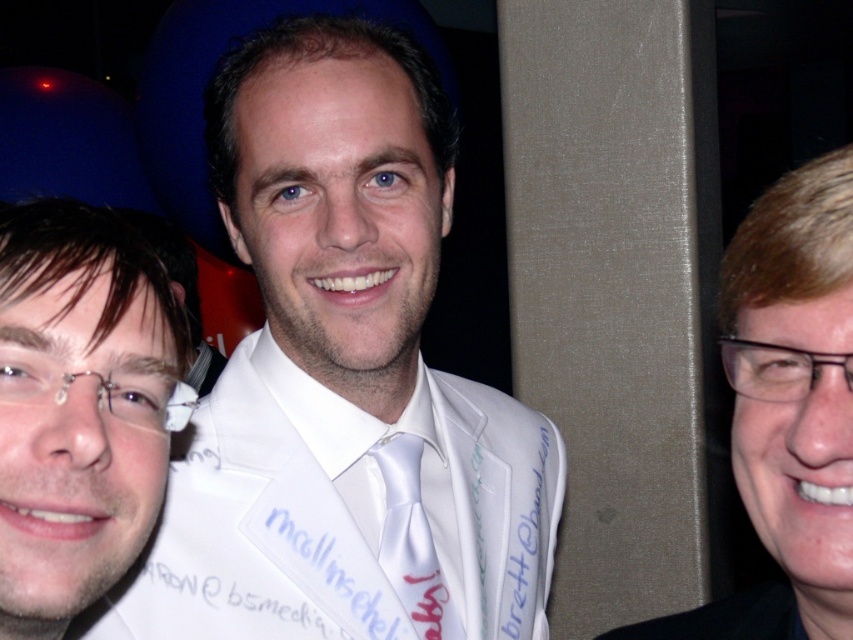
You are a photographer adjusting the lighting for a portrait. You notice the matte white shirt at center and the white satin tie at center. Which object should you focus on first if you want to ensure the taller one is properly lit?

The matte white shirt at center has a greater height compared to the white satin tie at center, so you should focus on lighting the matte white shirt at center first to ensure proper illumination of the taller object.

You are a photographer adjusting your camera settings. You notice the black glossy hair at right and the white satin tie at center. Which object should you focus on first to ensure both are in sharp focus?

The black glossy hair at right is closer to the viewer than the white satin tie at center. To ensure both are in sharp focus, you should focus on the black glossy hair at right first, as it is the closer object, and then adjust the focus to include the white satin tie at center within the depth of field.

Based on the scene description, what object corresponds to the coordinates point [343,380]?

The coordinates point [343,380] correspond to the white satin suit at center.